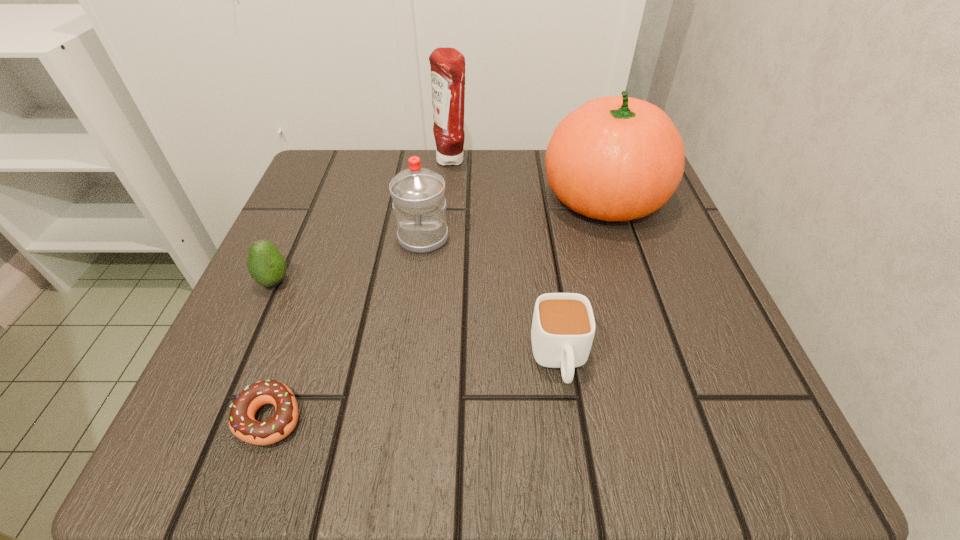
In order to click on condiment in this screenshot , I will do `click(447, 64)`.

Find the location of a particular element. The height and width of the screenshot is (540, 960). pumpkin is located at coordinates (616, 158).

You are a GUI agent. You are given a task and a screenshot of the screen. Output one action in this format:
    pyautogui.click(x=<x>, y=<y>)
    Task: Click on the water bottle
    
    Given the screenshot: What is the action you would take?
    pyautogui.click(x=418, y=194)

This screenshot has width=960, height=540. I want to click on avocado, so click(267, 266).

Identify the location of the leftmost object. (267, 266).

This screenshot has width=960, height=540. In order to click on cup in this screenshot , I will do `click(563, 327)`.

The height and width of the screenshot is (540, 960). In order to click on the shortest object in this screenshot , I will do (x=242, y=423).

I want to click on doughnut, so click(x=242, y=423).

Image resolution: width=960 pixels, height=540 pixels. I want to click on free region located on the left of the condiment, so click(391, 160).

Locate an element on the screen. blank area located on the front of the pumpkin is located at coordinates (667, 390).